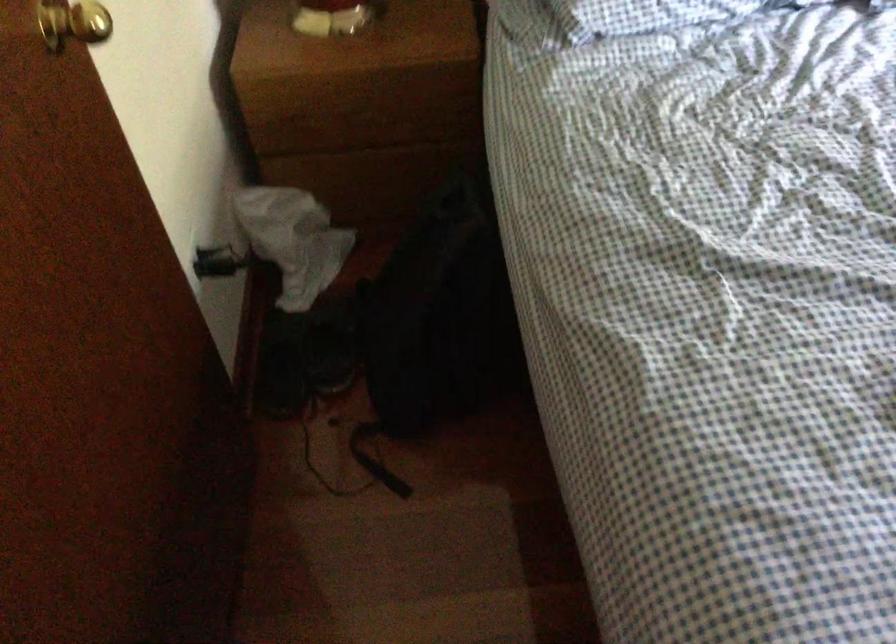
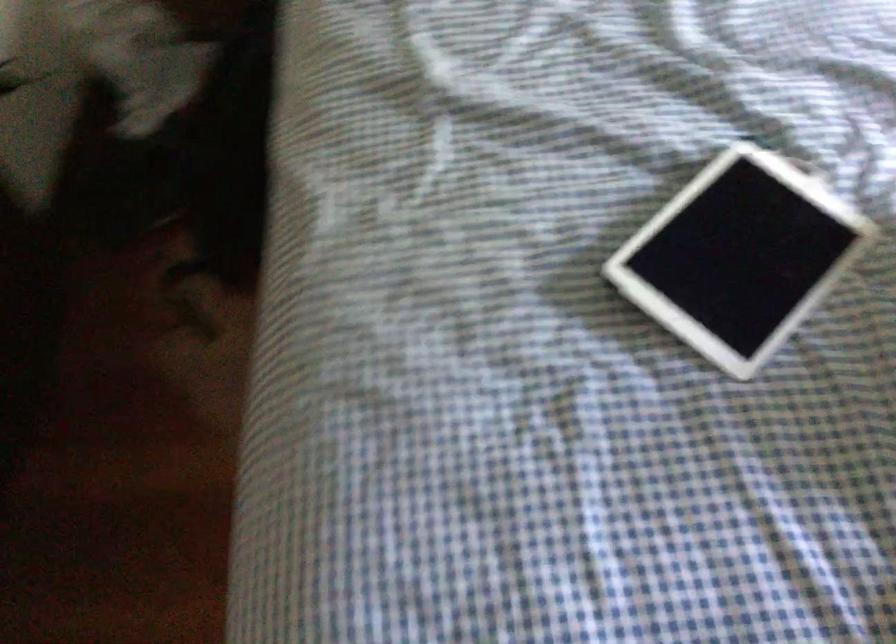
Question: What movement of the cameraman would produce the second image?

Choices:
 (A) Left
 (B) Right
 (C) Forward
 (D) Backward

Answer: (B)